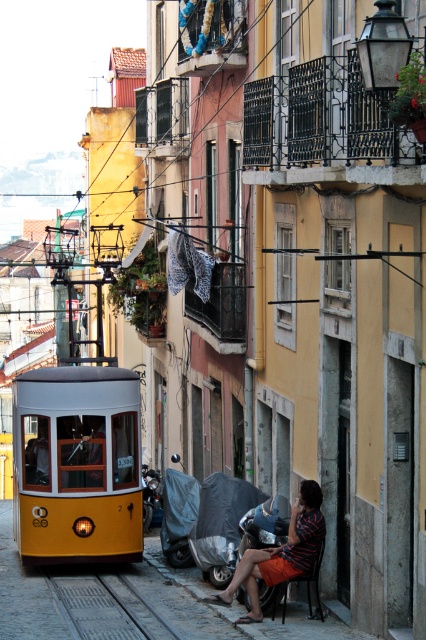
You are standing at the tram and looking towards the man sitting on the chair. Where is the striped fabric shirt at lower center located relative to the point marked at coordinates (279, 554)?

The striped fabric shirt at lower center is located exactly at the point marked at coordinates (279, 554).